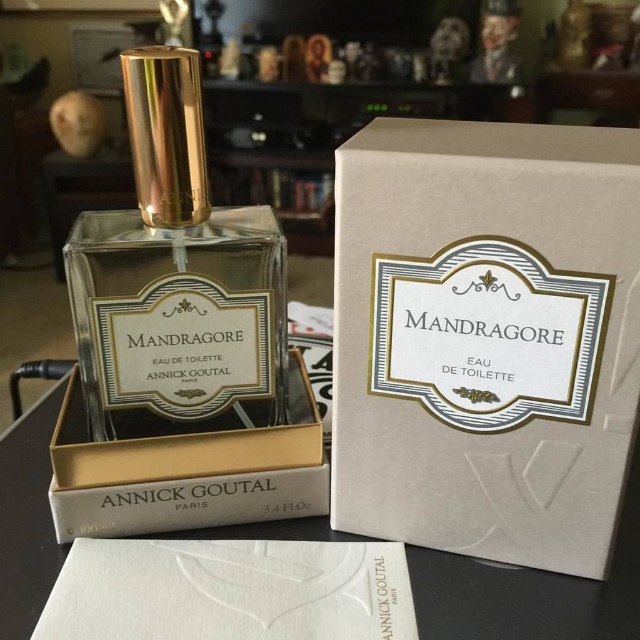
Can you confirm if matte glass perfume at center is positioned above matte gold box at center?

Yes, matte glass perfume at center is above matte gold box at center.

Between point (99, 225) and point (161, 522), which one is positioned in front?

Point (161, 522)

Locate an element on the screen. This screenshot has height=640, width=640. matte glass perfume at center is located at coordinates (176, 273).

Consider the image. Can you confirm if white cardboard box at center is thinner than matte glass perfume at center?

In fact, white cardboard box at center might be wider than matte glass perfume at center.

Measure the distance between white cardboard box at center and camera.

white cardboard box at center and camera are 10.71 inches apart from each other.

The width and height of the screenshot is (640, 640). What are the coordinates of `white cardboard box at center` in the screenshot? It's located at (484, 337).

Between white cardboard box at center and matte gold box at center, which one has less height?

matte gold box at center is shorter.

Is white cardboard box at center bigger than matte gold box at center?

Indeed, white cardboard box at center has a larger size compared to matte gold box at center.

The width and height of the screenshot is (640, 640). Describe the element at coordinates (484, 337) in the screenshot. I see `white cardboard box at center` at that location.

Locate an element on the screen. The image size is (640, 640). white cardboard box at center is located at coordinates (484, 337).